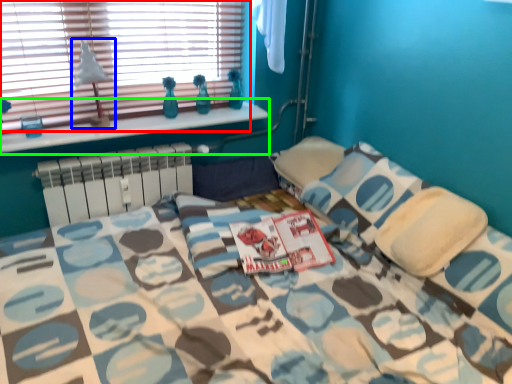
Question: Based on their relative distances, which object is nearer to window (highlighted by a red box)? Choose from table lamp (highlighted by a blue box) and window sill (highlighted by a green box).

Choices:
 (A) table lamp
 (B) window sill

Answer: (A)